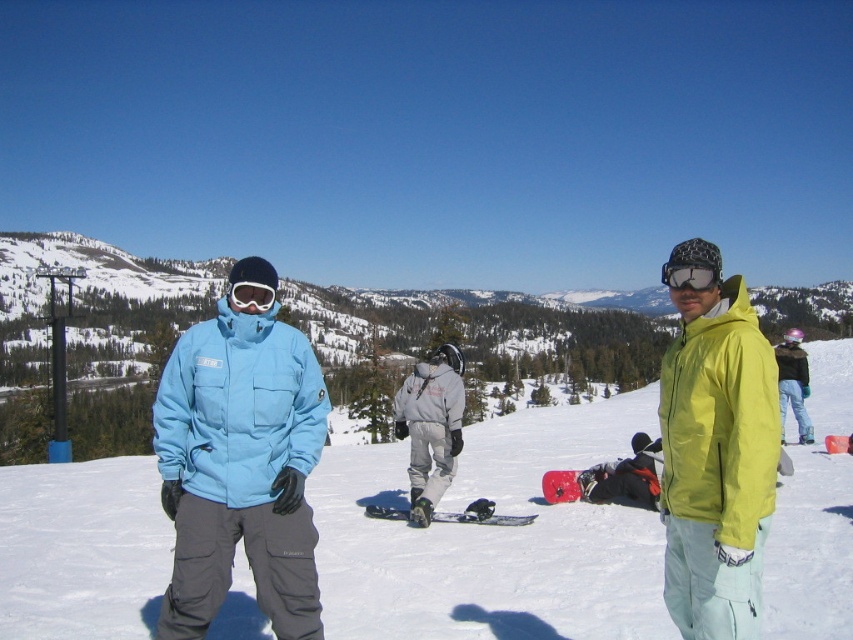
Question: Which object is the closest to the white snowboard at center?

Choices:
 (A) white matte goggles at upper center
 (B) red matte snowboard at center

Answer: (A)

Question: Which point is closer to the camera taking this photo?

Choices:
 (A) (235, 296)
 (B) (392, 582)

Answer: (B)

Question: In this image, where is matte blue jacket at left located relative to matte black goggles at right?

Choices:
 (A) above
 (B) below

Answer: (B)

Question: Which point is farther to the camera?

Choices:
 (A) matte black goggles at right
 (B) red matte snowboard at center

Answer: (B)

Question: Is matte blue jacket at left wider than matte black goggles at right?

Choices:
 (A) yes
 (B) no

Answer: (B)

Question: Is matte yellow jacket at right below red matte snowboard at center?

Choices:
 (A) yes
 (B) no

Answer: (B)